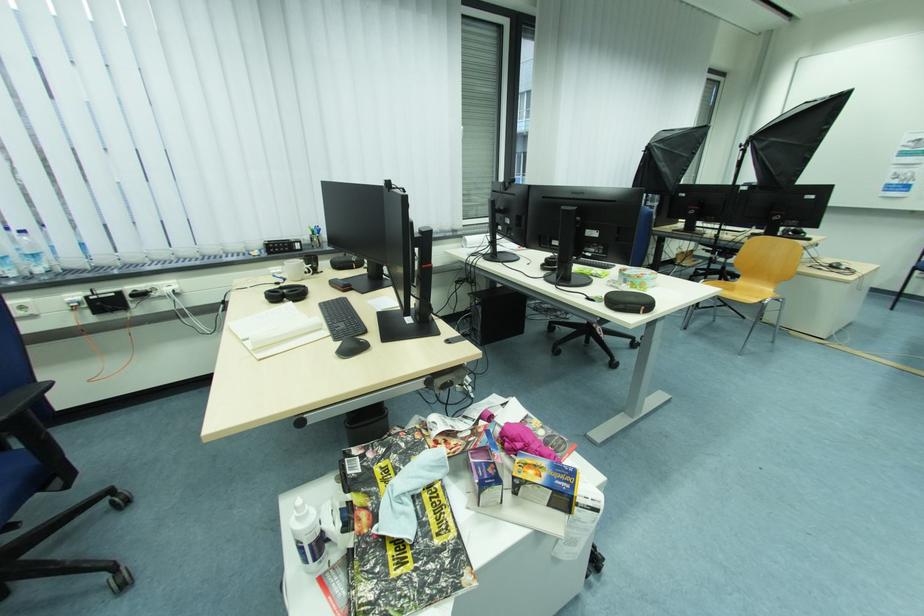
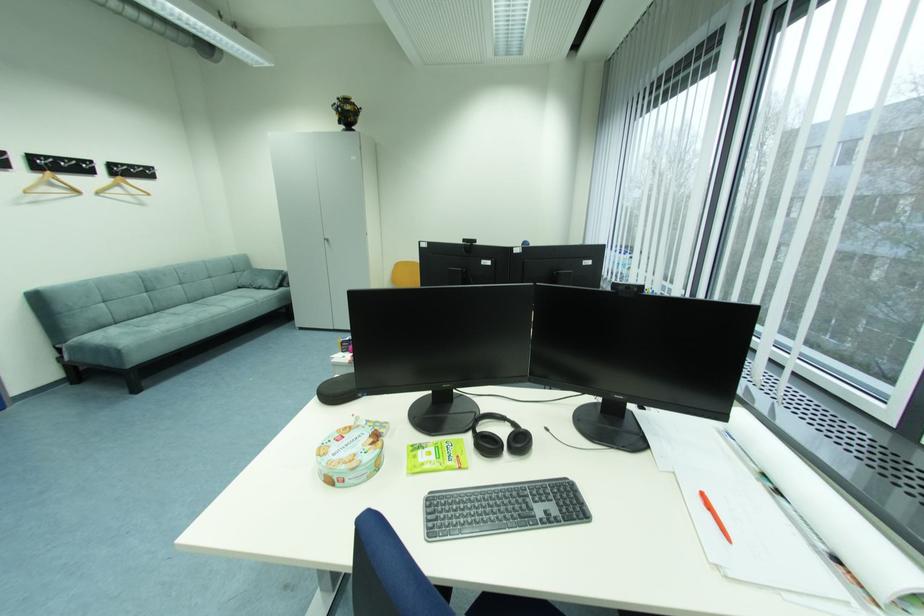
Question: I am providing you with two images of the same scene from different viewpoints. Which of the following objects are not visible in image2?

Choices:
 (A) kitchen faucet handle
 (B) black coat hook
 (C) plastic water bottle
 (D) sofa armrest

Answer: (C)